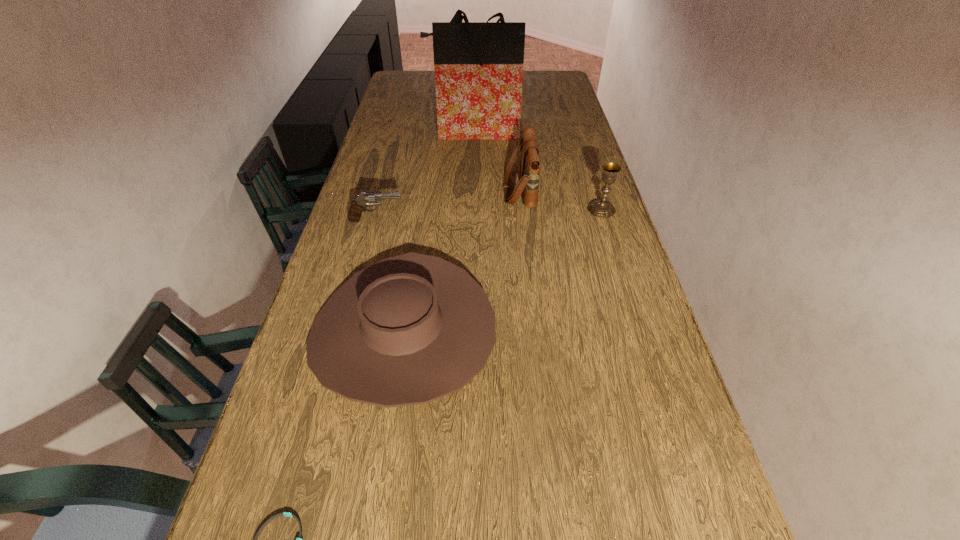
The image size is (960, 540). I want to click on blank area in the image that satisfies the following two spatial constraints: 1. on the front side of the fourth shortest object; 2. on the left side of the farthest object, so click(471, 210).

Identify the location of vacant space that satisfies the following two spatial constraints: 1. on the back side of the rightmost object; 2. on the left side of the cowboy hat. tap(422, 210).